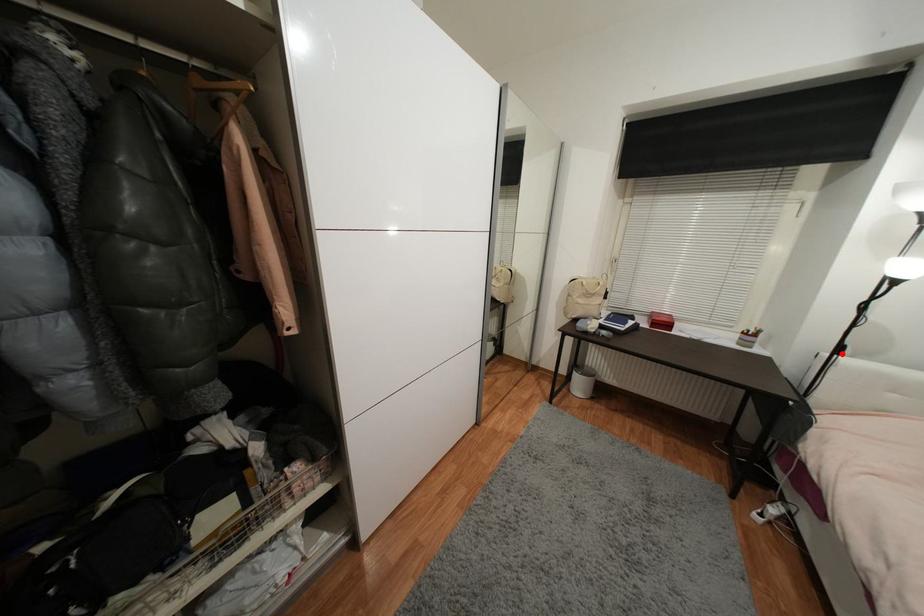
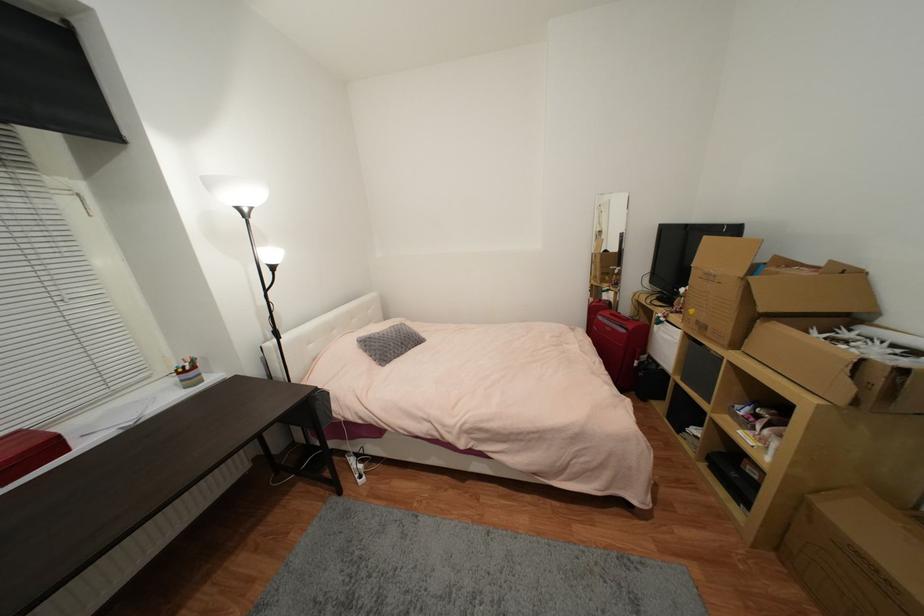
Where in the second image is the point corresponding to the highlighted location from the first image?

(283, 339)